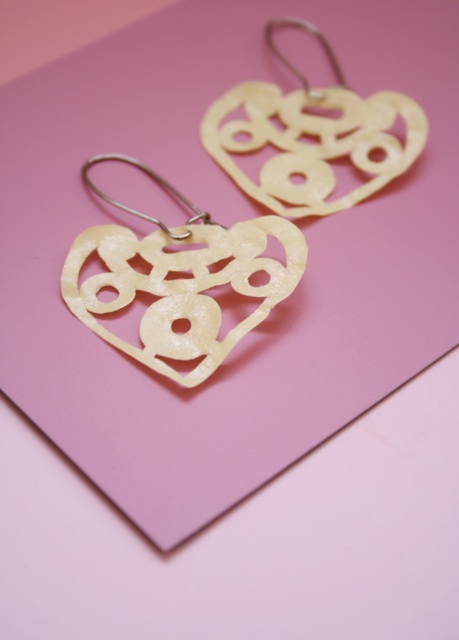
Question: Which is farther from the ivory matte heart-shaped earring at upper center?

Choices:
 (A) ivory matte heart at center
 (B) polished metal hook at upper left

Answer: (A)

Question: Is ivory matte heart-shaped earring at upper center further to the viewer compared to polished metal hook at upper left?

Choices:
 (A) yes
 (B) no

Answer: (A)

Question: Is ivory matte heart-shaped earring at upper center bigger than polished metal hook at upper left?

Choices:
 (A) yes
 (B) no

Answer: (A)

Question: Is ivory matte heart-shaped earring at upper center positioned behind polished metal hook at upper left?

Choices:
 (A) no
 (B) yes

Answer: (B)

Question: Which point appears closest to the camera in this image?

Choices:
 (A) (375, 148)
 (B) (172, 323)
 (C) (94, 189)

Answer: (B)

Question: Among these points, which one is nearest to the camera?

Choices:
 (A) (395, 93)
 (B) (206, 212)
 (C) (167, 268)

Answer: (C)